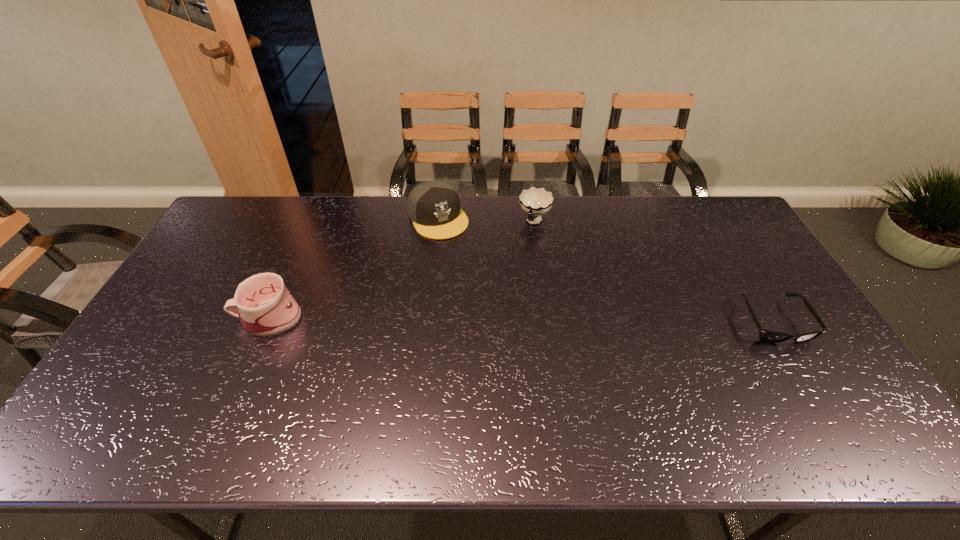
Find the location of a particular element. This screenshot has width=960, height=540. free point at the left edge is located at coordinates (197, 324).

This screenshot has width=960, height=540. Find the location of `vacant space at the right edge of the desktop`. vacant space at the right edge of the desktop is located at coordinates (729, 252).

Identify the location of vacant space at the far left corner. coord(221,227).

In the image, there is a desktop. At what (x,y) coordinates should I click in order to perform the action: click on free space at the far right corner. Please return your answer as a coordinate pair (x, y). This screenshot has width=960, height=540. Looking at the image, I should click on (698, 201).

Where is `unoccupied area between the third object from right to left and the sunglasses`? Image resolution: width=960 pixels, height=540 pixels. unoccupied area between the third object from right to left and the sunglasses is located at coordinates (606, 270).

Where is `vacant space that's between the leftmost object and the cap`? The image size is (960, 540). vacant space that's between the leftmost object and the cap is located at coordinates (353, 268).

Where is `free area in between the sunglasses and the leftmost object`? The image size is (960, 540). free area in between the sunglasses and the leftmost object is located at coordinates (520, 320).

I want to click on vacant space that's between the third object from left to right and the sunglasses, so (x=654, y=272).

Where is `unoccupied position between the second object from right to left and the cap`? Image resolution: width=960 pixels, height=540 pixels. unoccupied position between the second object from right to left and the cap is located at coordinates (487, 220).

This screenshot has height=540, width=960. I want to click on free point between the cup and the mug, so click(401, 270).